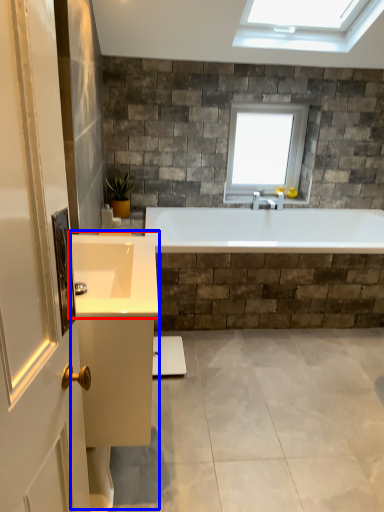
Question: Which of the following is the farthest to the observer, sink (highlighted by a red box) or vanity (highlighted by a blue box)?

Choices:
 (A) sink
 (B) vanity

Answer: (B)